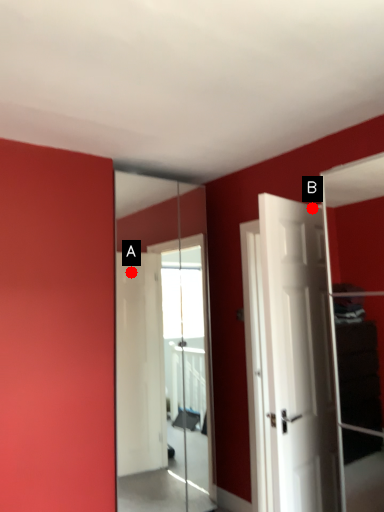
Question: Two points are circled on the image, labeled by A and B beside each circle. Which point appears closest to the camera in this image?

Choices:
 (A) A is closer
 (B) B is closer

Answer: (B)